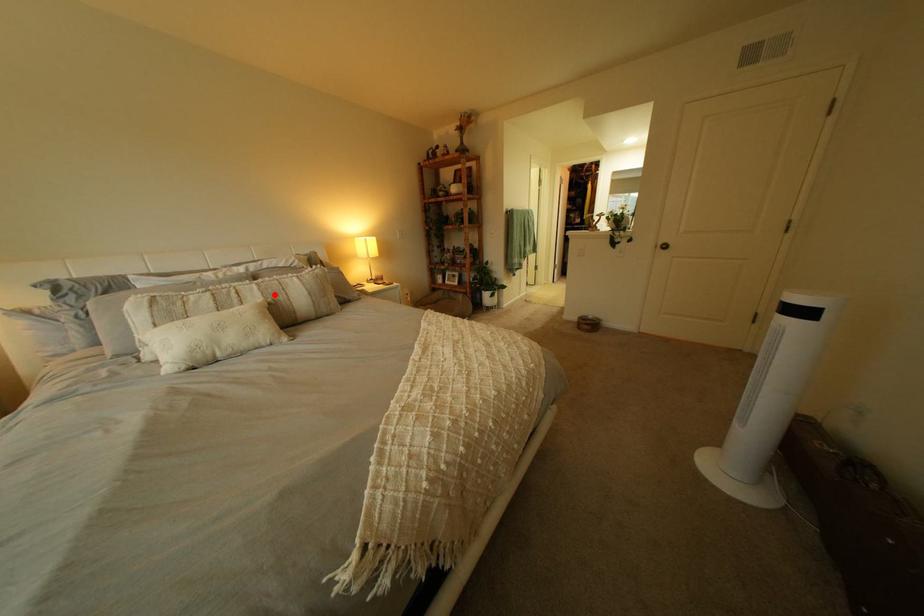
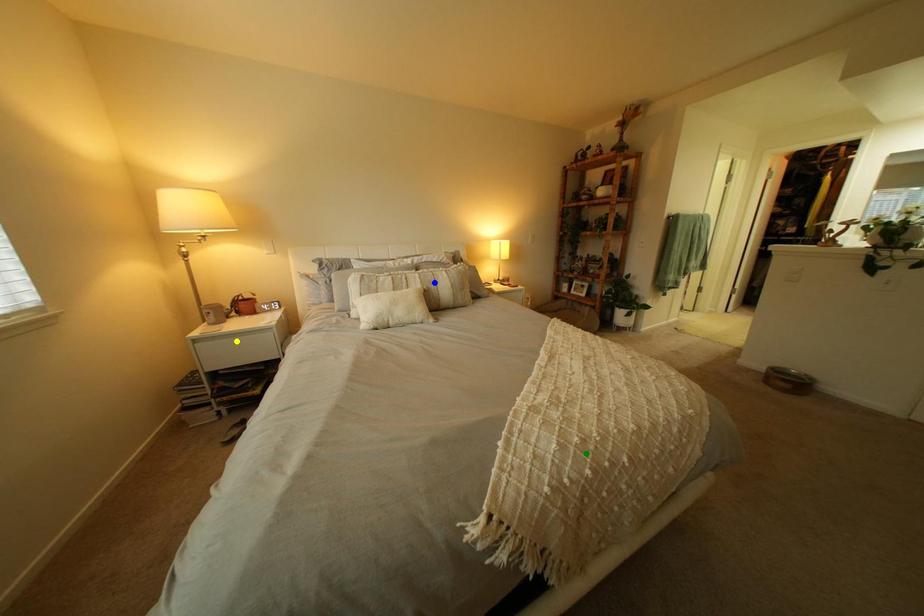
Question: I am providing you with two images of the same scene from different viewpoints. A red point is marked on the first image. You are given multiple points on the second image. Which point in image 2 represents the same 3d spot as the red point in image 1?

Choices:
 (A) yellow point
 (B) green point
 (C) blue point

Answer: (C)